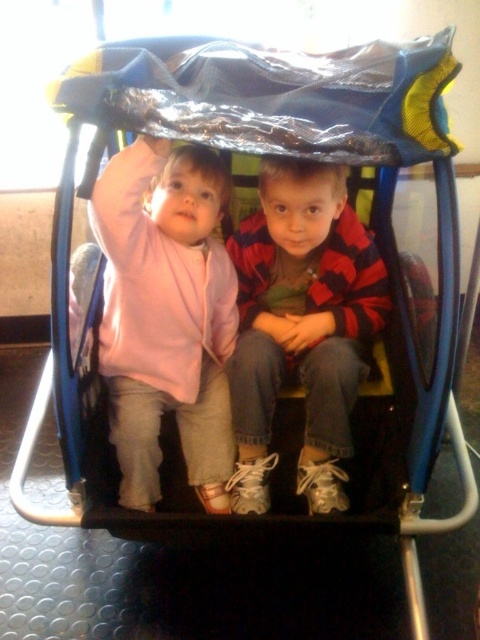
Question: Observing the image, what is the correct spatial positioning of matte pink sweater at upper left in reference to red plaid shirt at center?

Choices:
 (A) below
 (B) above

Answer: (B)

Question: Can you confirm if matte pink sweater at upper left is positioned below red plaid shirt at center?

Choices:
 (A) no
 (B) yes

Answer: (A)

Question: Which point is closer to the camera taking this photo?

Choices:
 (A) (149, 260)
 (B) (347, 372)

Answer: (A)

Question: Does matte pink sweater at upper left appear on the right side of red plaid shirt at center?

Choices:
 (A) no
 (B) yes

Answer: (A)

Question: Which point is closer to the camera taking this photo?

Choices:
 (A) (216, 193)
 (B) (319, 321)

Answer: (A)

Question: Which point is farther to the camera?

Choices:
 (A) matte pink sweater at upper left
 (B) red plaid shirt at center

Answer: (B)